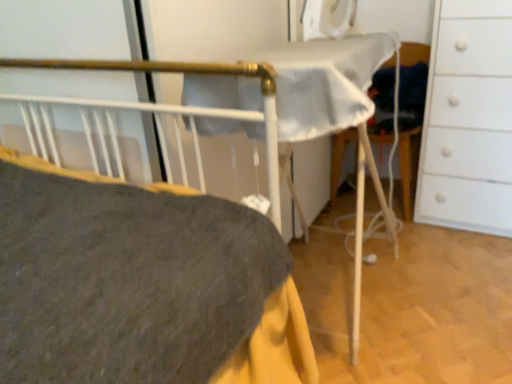
The height and width of the screenshot is (384, 512). What do you see at coordinates (408, 166) in the screenshot? I see `white fabric folding chair at center` at bounding box center [408, 166].

What is the approximate height of white fabric folding chair at center?

white fabric folding chair at center is 30.14 inches tall.

Locate an element on the screen. white fabric folding chair at center is located at coordinates (408, 166).

At what (x,y) coordinates should I click in order to perform the action: click on white matte chest of drawers at right. Please return your answer as a coordinate pair (x, y). Image resolution: width=512 pixels, height=384 pixels. Looking at the image, I should click on (468, 119).

What do you see at coordinates (468, 119) in the screenshot?
I see `white matte chest of drawers at right` at bounding box center [468, 119].

In the scene shown: Measure the distance between point (x=425, y=169) and camera.

Point (x=425, y=169) is 1.86 meters away from camera.

You are a GUI agent. You are given a task and a screenshot of the screen. Output one action in this format:
    pyautogui.click(x=<x>, y=<y>)
    Task: Click on the white fabric folding chair at center
    The width and height of the screenshot is (512, 384).
    Given the screenshot: What is the action you would take?
    (x=408, y=166)

Looking at this image, between white matte chest of drawers at right and white fabric folding chair at center, which one appears on the right side from the viewer's perspective?

white matte chest of drawers at right.

Considering their positions, is white matte chest of drawers at right located in front of or behind white fabric folding chair at center?

In the image, white matte chest of drawers at right appears in front of white fabric folding chair at center.

Does point (480, 203) come in front of point (396, 57)?

That is True.

From the image's perspective, is white matte chest of drawers at right above white fabric folding chair at center?

Indeed, from the image's perspective, white matte chest of drawers at right is shown above white fabric folding chair at center.

From a real-world perspective, which is physically below, white matte chest of drawers at right or white fabric folding chair at center?

white fabric folding chair at center, from a real-world perspective.

Considering the relative sizes of white matte chest of drawers at right and white fabric folding chair at center in the image provided, is white matte chest of drawers at right wider than white fabric folding chair at center?

Indeed, white matte chest of drawers at right has a greater width compared to white fabric folding chair at center.

Does white matte chest of drawers at right have a greater height compared to white fabric folding chair at center?

Correct, white matte chest of drawers at right is much taller as white fabric folding chair at center.

Is white matte chest of drawers at right bigger than white fabric folding chair at center?

Indeed, white matte chest of drawers at right has a larger size compared to white fabric folding chair at center.

Is white matte chest of drawers at right not inside white fabric folding chair at center?

Yes, white matte chest of drawers at right is outside of white fabric folding chair at center.

Is white matte chest of drawers at right in contact with white fabric folding chair at center?

No, white matte chest of drawers at right is not next to white fabric folding chair at center.

From the picture: Is white matte chest of drawers at right turned away from white fabric folding chair at center?

No.

Where is `folding chair behind the white matte chest of drawers at right`? The image size is (512, 384). folding chair behind the white matte chest of drawers at right is located at coordinates (408, 166).

Based on the photo, would you say white fabric folding chair at center is to the left or to the right of white matte chest of drawers at right in the picture?

Clearly, white fabric folding chair at center is on the left of white matte chest of drawers at right in the image.

Is the depth of white fabric folding chair at center greater than that of white matte chest of drawers at right?

Yes, white fabric folding chair at center is behind white matte chest of drawers at right.

Is point (338, 149) closer or farther from the camera than point (502, 24)?

Point (338, 149) appears to be farther away from the viewer than point (502, 24).

From the image's perspective, does white fabric folding chair at center appear lower than white matte chest of drawers at right?

Yes.

From the picture: From a real-world perspective, is white fabric folding chair at center above or below white matte chest of drawers at right?

white fabric folding chair at center is below white matte chest of drawers at right.

Between white fabric folding chair at center and white matte chest of drawers at right, which one has larger width?

Wider between the two is white matte chest of drawers at right.

Is white fabric folding chair at center taller or shorter than white matte chest of drawers at right?

white fabric folding chair at center is shorter than white matte chest of drawers at right.

Which of these two, white fabric folding chair at center or white matte chest of drawers at right, is smaller?

white fabric folding chair at center is smaller.

Which is correct: white fabric folding chair at center is inside white matte chest of drawers at right, or outside of it?

white fabric folding chair at center is not inside white matte chest of drawers at right, it's outside.

Is there a large distance between white fabric folding chair at center and white matte chest of drawers at right?

Actually, white fabric folding chair at center and white matte chest of drawers at right are a little close together.

Is white fabric folding chair at center facing towards white matte chest of drawers at right?

No, white fabric folding chair at center is not turned towards white matte chest of drawers at right.

There is a white fabric folding chair at center. What are the coordinates of `the chest of drawers above it (from a real-world perspective)` in the screenshot? It's located at (468, 119).

This screenshot has width=512, height=384. I want to click on chest of drawers on the right of white fabric folding chair at center, so click(x=468, y=119).

The height and width of the screenshot is (384, 512). Identify the location of folding chair that is below the white matte chest of drawers at right (from the image's perspective). (408, 166).